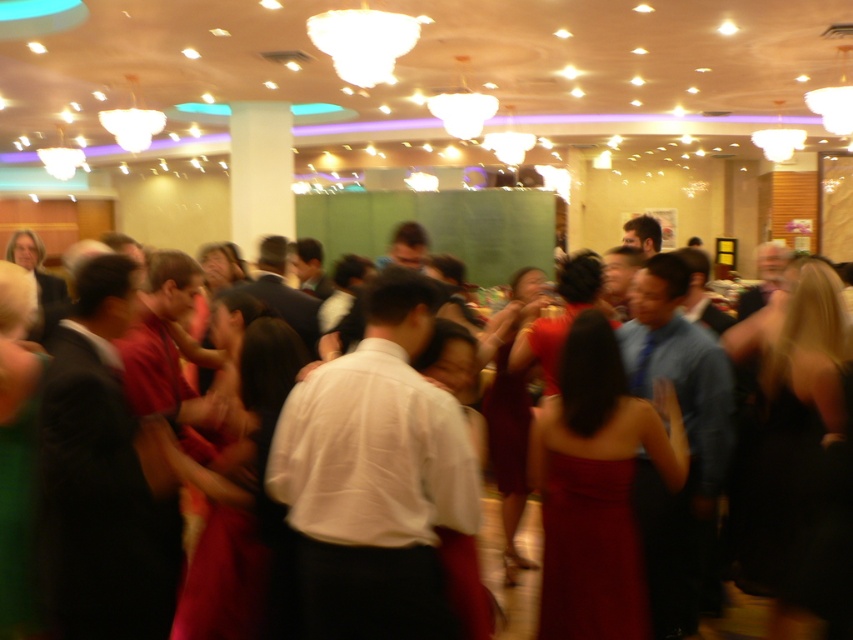
You are standing in the banquet hall and want to take a photo of the point at coordinates (154, 337). If your camera has a maximum focus range of 2.5 meters, will it be able to focus on that point?

The point at coordinates (154, 337) is 3.00 meters away from the camera, which exceeds the maximum focus range of 2.5 meters. Therefore, the camera cannot focus on that point.

You are a photographer at the event and need to capture both the matte red dress at center and the velvet burgundy dress at center in a single frame. Considering their sizes, which dress should you focus on to ensure both fit in the photo without cropping?

Since the matte red dress at center is smaller than the velvet burgundy dress at center, you should focus on positioning the camera to include the larger velvet burgundy dress at center first, ensuring there is enough space for the smaller matte red dress at center in the frame.

You are at the entrance of the banquet hall and want to find the matte white dress at center. Based on the coordinates provided, in which direction should you look to locate it?

The matte white dress at center is located at coordinates point (503, 576), which means you should look towards the lower right direction from your current position at the entrance to find it.